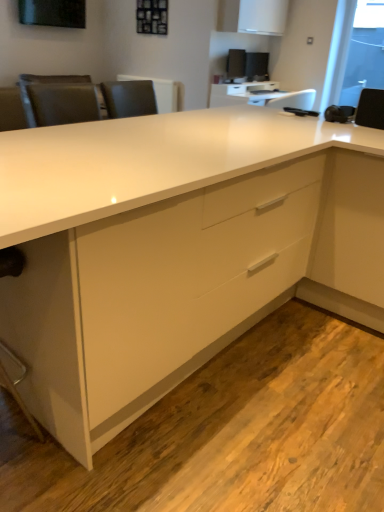
The height and width of the screenshot is (512, 384). Identify the location of white matte cabinet at upper center. (x=252, y=16).

What are the coordinates of `satin black monitor at upper center, positioned as the first computer monitor in left-to-right order` in the screenshot? It's located at (236, 63).

How much space does satin black monitor at upper center, the 2th computer monitor positioned from the left, occupy horizontally?

The width of satin black monitor at upper center, the 2th computer monitor positioned from the left, is 3.91 inches.

In order to click on white glossy table at upper center in this screenshot , I will do `click(260, 95)`.

Are white glossy table at upper center and transparent glass window screen at upper right far apart?

No, white glossy table at upper center is in close proximity to transparent glass window screen at upper right.

Consider the image. Does white glossy table at upper center appear on the left side of transparent glass window screen at upper right?

Yes.

Could you tell me if white glossy table at upper center is facing transparent glass window screen at upper right?

No, white glossy table at upper center is not facing towards transparent glass window screen at upper right.

Is white glossy table at upper center located within satin black monitor at upper center, the 1th computer monitor in the right-to-left sequence?

That's incorrect, white glossy table at upper center is not inside satin black monitor at upper center, the 1th computer monitor in the right-to-left sequence.

Considering the relative sizes of satin black monitor at upper center, the 2th computer monitor positioned from the left, and white glossy table at upper center in the image provided, is satin black monitor at upper center, the 2th computer monitor positioned from the left, shorter than white glossy table at upper center?

In fact, satin black monitor at upper center, the 2th computer monitor positioned from the left, may be taller than white glossy table at upper center.

Can you confirm if satin black monitor at upper center, the 1th computer monitor in the right-to-left sequence, is wider than white glossy table at upper center?

In fact, satin black monitor at upper center, the 1th computer monitor in the right-to-left sequence, might be narrower than white glossy table at upper center.

Would you consider satin black monitor at upper center, the 2th computer monitor positioned from the left, to be distant from white glossy table at upper center?

That's right, there is a large distance between satin black monitor at upper center, the 2th computer monitor positioned from the left, and white glossy table at upper center.

Consider the image. Which object is positioned more to the left, satin black monitor at upper center, the 1th computer monitor in the right-to-left sequence, or transparent glass window screen at upper right?

satin black monitor at upper center, the 1th computer monitor in the right-to-left sequence.

Do you think satin black monitor at upper center, the 1th computer monitor in the right-to-left sequence, is within transparent glass window screen at upper right, or outside of it?

The correct answer is: outside.

Considering the relative sizes of satin black monitor at upper center, the 1th computer monitor in the right-to-left sequence, and transparent glass window screen at upper right in the image provided, is satin black monitor at upper center, the 1th computer monitor in the right-to-left sequence, shorter than transparent glass window screen at upper right?

Yes, satin black monitor at upper center, the 1th computer monitor in the right-to-left sequence, is shorter than transparent glass window screen at upper right.

Is satin black monitor at upper center, the 1th computer monitor in the right-to-left sequence, not near transparent glass window screen at upper right?

Yes, satin black monitor at upper center, the 1th computer monitor in the right-to-left sequence, and transparent glass window screen at upper right are quite far apart.

Does point (257, 105) come behind point (142, 141)?

Yes, point (257, 105) is behind point (142, 141).

In terms of width, does white glossy table at upper center look wider or thinner when compared to white glossy desk at center?

white glossy table at upper center is thinner than white glossy desk at center.

Measure the distance from white glossy table at upper center to white glossy desk at center.

They are 3.68 meters apart.

Is white glossy table at upper center to the left of white glossy desk at center from the viewer's perspective?

No.

Identify the location of cabinetry above the transparent glass window screen at upper right (from the image's perspective). (252, 16).

Which object is positioned more to the left, transparent glass window screen at upper right or white matte cabinet at upper center?

From the viewer's perspective, white matte cabinet at upper center appears more on the left side.

Between transparent glass window screen at upper right and white matte cabinet at upper center, which one has smaller size?

With smaller size is transparent glass window screen at upper right.

Would you say transparent glass window screen at upper right is outside white matte cabinet at upper center?

transparent glass window screen at upper right is positioned outside white matte cabinet at upper center.

Looking at this image, are satin black monitor at upper center, positioned as the first computer monitor in left-to-right order, and transparent glass window screen at upper right far apart?

Yes, satin black monitor at upper center, positioned as the first computer monitor in left-to-right order, and transparent glass window screen at upper right are quite far apart.

From a real-world perspective, is satin black monitor at upper center, which is counted as the 2th computer monitor, starting from the right, physically located above or below transparent glass window screen at upper right?

From a real-world perspective, satin black monitor at upper center, which is counted as the 2th computer monitor, starting from the right, is physically below transparent glass window screen at upper right.

Which of these two, satin black monitor at upper center, which is counted as the 2th computer monitor, starting from the right, or transparent glass window screen at upper right, is thinner?

transparent glass window screen at upper right.

Does point (278, 4) come closer to viewer compared to point (365, 20)?

No, (278, 4) is further to viewer.

Could you measure the distance between white matte cabinet at upper center and transparent glass window screen at upper right?

They are 1.91 meters apart.

Would you say white matte cabinet at upper center is inside or outside transparent glass window screen at upper right?

The correct answer is: outside.

Is white matte cabinet at upper center oriented away from transparent glass window screen at upper right?

No, white matte cabinet at upper center is not facing away from transparent glass window screen at upper right.

Find the location of a particular element. window screen in front of the white glossy table at upper center is located at coordinates (364, 52).

Where is `table that is below the satin black monitor at upper center, the 2th computer monitor positioned from the left (from the image's perspective)`? table that is below the satin black monitor at upper center, the 2th computer monitor positioned from the left (from the image's perspective) is located at coordinates [260, 95].

Looking at the image, which one is located closer to white glossy desk at center, white matte cabinet at upper center or satin black monitor at upper center, the 1th computer monitor in the right-to-left sequence?

white matte cabinet at upper center.

Considering their positions, is white glossy desk at center positioned further to satin black monitor at upper center, the 1th computer monitor in the right-to-left sequence, than white glossy table at upper center?

white glossy desk at center.

Looking at the image, which one is located further to satin black monitor at upper center, which is counted as the 2th computer monitor, starting from the right, white glossy desk at center or white glossy table at upper center?

white glossy desk at center.

Estimate the real-world distances between objects in this image. Which object is closer to transparent glass window screen at upper right, white matte cabinet at upper center or white glossy desk at center?

white matte cabinet at upper center is closer to transparent glass window screen at upper right.

Based on their spatial positions, is satin black monitor at upper center, positioned as the first computer monitor in left-to-right order, or transparent glass window screen at upper right closer to white glossy table at upper center?

The object closer to white glossy table at upper center is transparent glass window screen at upper right.

Estimate the real-world distances between objects in this image. Which object is further from satin black monitor at upper center, the 2th computer monitor positioned from the left, white glossy table at upper center or white glossy desk at center?

white glossy desk at center is further to satin black monitor at upper center, the 2th computer monitor positioned from the left.

Looking at the image, which one is located further to white glossy table at upper center, white glossy desk at center or white matte cabinet at upper center?

white glossy desk at center lies further to white glossy table at upper center than the other object.

When comparing their distances from white matte cabinet at upper center, does white glossy desk at center or transparent glass window screen at upper right seem closer?

Based on the image, transparent glass window screen at upper right appears to be nearer to white matte cabinet at upper center.

Locate an element on the screen. cabinetry located between satin black monitor at upper center, positioned as the first computer monitor in left-to-right order, and transparent glass window screen at upper right in the left-right direction is located at coordinates (252, 16).

Find the location of a particular element. table between white glossy desk at center and satin black monitor at upper center, positioned as the first computer monitor in left-to-right order, in the front-back direction is located at coordinates (260, 95).

Find the location of a particular element. computer monitor between white glossy table at upper center and transparent glass window screen at upper right is located at coordinates (257, 66).

This screenshot has width=384, height=512. In order to click on computer monitor between satin black monitor at upper center, positioned as the first computer monitor in left-to-right order, and transparent glass window screen at upper right in this screenshot , I will do `click(257, 66)`.